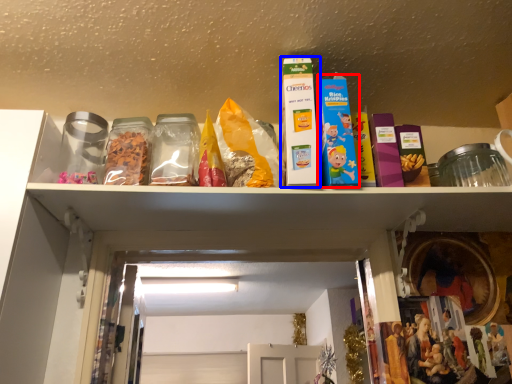
Question: Among these objects, which one is farthest to the camera, product (highlighted by a red box) or product (highlighted by a blue box)?

Choices:
 (A) product
 (B) product

Answer: (A)